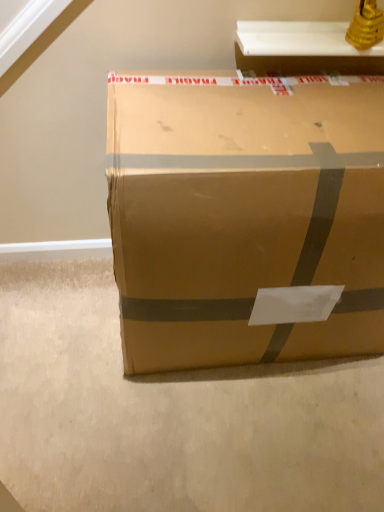
You are a GUI agent. You are given a task and a screenshot of the screen. Output one action in this format:
    pyautogui.click(x=<x>, y=<y>)
    Task: Click on the free space that is to the left of brown cardboard box at center
    The width and height of the screenshot is (384, 512).
    Given the screenshot: What is the action you would take?
    pyautogui.click(x=61, y=340)